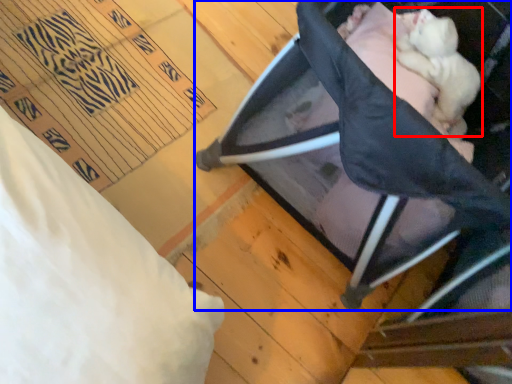
Question: Which object appears closest to the camera in this image, newborn (highlighted by a red box) or furniture (highlighted by a blue box)?

Choices:
 (A) newborn
 (B) furniture

Answer: (B)